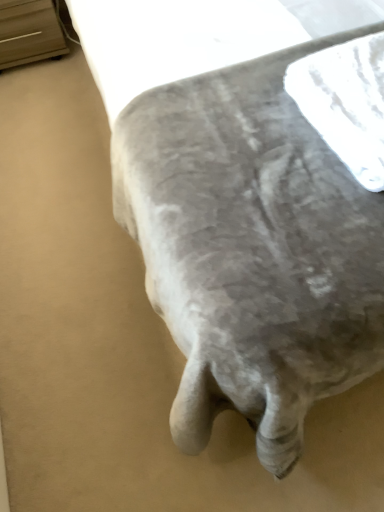
Question: From the image's perspective, is white textured fabric at center beneath matte wood dresser at upper left?

Choices:
 (A) no
 (B) yes

Answer: (B)

Question: Is white textured fabric at center facing away from matte wood dresser at upper left?

Choices:
 (A) yes
 (B) no

Answer: (B)

Question: Is white textured fabric at center bigger than matte wood dresser at upper left?

Choices:
 (A) no
 (B) yes

Answer: (A)

Question: Considering the relative sizes of white textured fabric at center and matte wood dresser at upper left in the image provided, is white textured fabric at center thinner than matte wood dresser at upper left?

Choices:
 (A) no
 (B) yes

Answer: (B)

Question: Is white textured fabric at center not within matte wood dresser at upper left?

Choices:
 (A) no
 (B) yes

Answer: (B)

Question: Does white textured fabric at center have a lesser height compared to matte wood dresser at upper left?

Choices:
 (A) no
 (B) yes

Answer: (B)

Question: Is matte wood dresser at upper left facing away from white textured fabric at center?

Choices:
 (A) no
 (B) yes

Answer: (A)

Question: Considering the relative sizes of matte wood dresser at upper left and white textured fabric at center in the image provided, is matte wood dresser at upper left bigger than white textured fabric at center?

Choices:
 (A) no
 (B) yes

Answer: (B)

Question: Can you confirm if matte wood dresser at upper left is wider than white textured fabric at center?

Choices:
 (A) yes
 (B) no

Answer: (A)

Question: From a real-world perspective, is matte wood dresser at upper left positioned over white textured fabric at center based on gravity?

Choices:
 (A) no
 (B) yes

Answer: (A)

Question: Is there a large distance between matte wood dresser at upper left and white textured fabric at center?

Choices:
 (A) no
 (B) yes

Answer: (B)

Question: Is matte wood dresser at upper left aimed at white textured fabric at center?

Choices:
 (A) no
 (B) yes

Answer: (A)

Question: Is point (4, 11) positioned closer to the camera than point (347, 52)?

Choices:
 (A) closer
 (B) farther

Answer: (B)